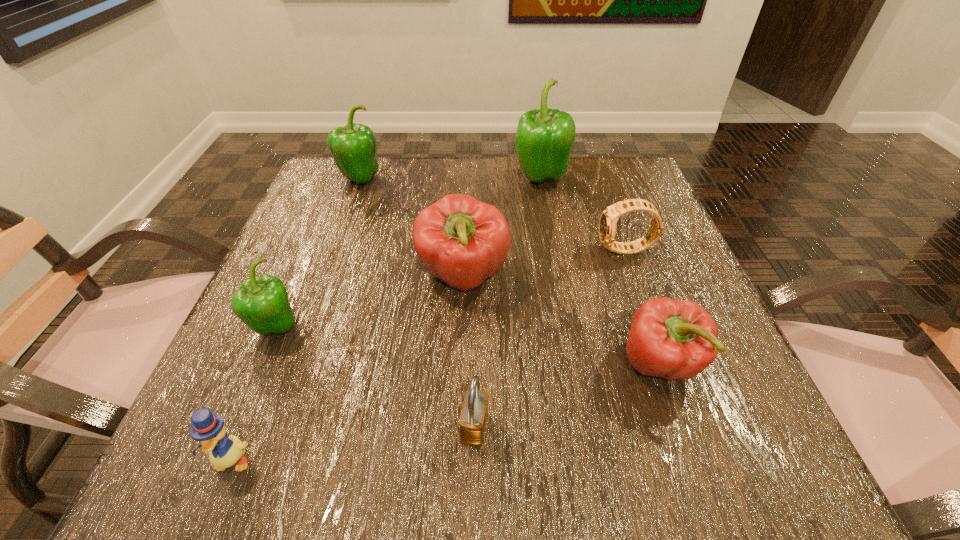
This screenshot has height=540, width=960. I want to click on vacant space that's between the right pink bell pepper and the padlock, so click(566, 396).

Where is `free space between the smaller pink bell pepper and the padlock`? free space between the smaller pink bell pepper and the padlock is located at coordinates (566, 396).

Identify which object is the sixth nearest to the black watch. Please provide its 2D coordinates. Your answer should be formatted as a tuple, i.e. [(x, y)], where the tuple contains the x and y coordinates of a point satisfying the conditions above.

[(261, 303)]

The width and height of the screenshot is (960, 540). Find the location of `the closest object to the smaller pink bell pepper`. the closest object to the smaller pink bell pepper is located at coordinates [x=462, y=241].

At what (x,y) coordinates should I click in order to perform the action: click on bell pepper identified as the third closest to the third bell pepper from left to right. Please return your answer as a coordinate pair (x, y). Image resolution: width=960 pixels, height=540 pixels. Looking at the image, I should click on (544, 138).

Choose which bell pepper is the fourth nearest neighbor to the sixth object from left to right. Please provide its 2D coordinates. Your answer should be formatted as a tuple, i.e. [(x, y)], where the tuple contains the x and y coordinates of a point satisfying the conditions above.

[(261, 303)]

Select which green bell pepper appears as the third closest to the padlock. Please provide its 2D coordinates. Your answer should be formatted as a tuple, i.e. [(x, y)], where the tuple contains the x and y coordinates of a point satisfying the conditions above.

[(353, 147)]

The height and width of the screenshot is (540, 960). What are the coordinates of `green bell pepper that stands as the closest to the second smallest green bell pepper` in the screenshot? It's located at (544, 138).

Locate an element on the screen. The image size is (960, 540). free space that satisfies the following two spatial constraints: 1. on the face of the black watch; 2. on the face of the yellow duckling, where the monocle is placed is located at coordinates (702, 461).

Locate an element on the screen. blank area in the image that satisfies the following two spatial constraints: 1. on the face of the black watch; 2. on the front side of the padlock is located at coordinates (690, 428).